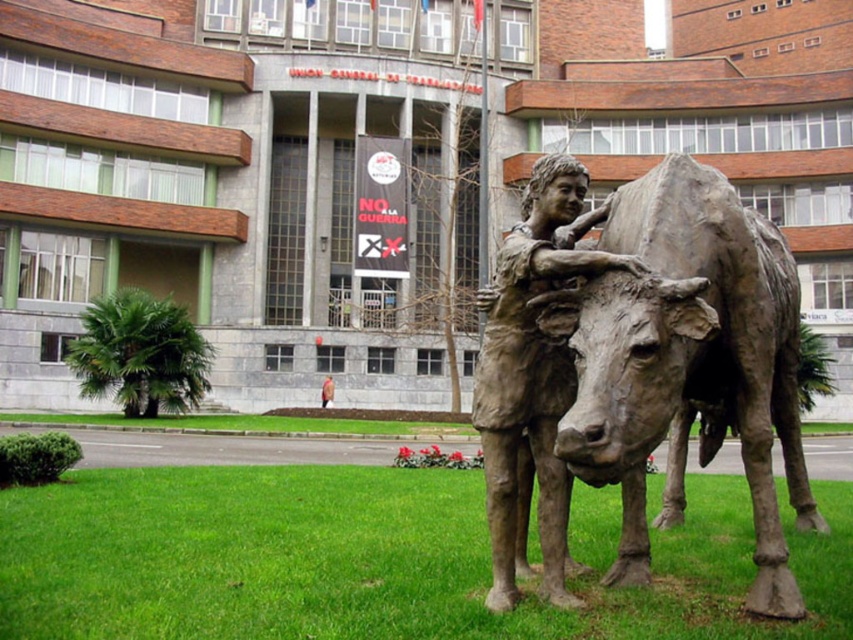
You are standing at the point marked by coordinates (367, 561) in the image. What is the immediate surface beneath your feet?

The immediate surface beneath your feet at point (367, 561) is green grass at lower center.

You are a photographer planning to take a picture of the bronze statue at center. You want to ensure the green grass at lower center appears smaller in the photo. What should you do?

Since the green grass at lower center has a smaller size compared to bronze statue at center, you can position yourself closer to the bronze statue at center to emphasize its size relative to the green grass at lower center, making the grass appear even smaller in the photo.